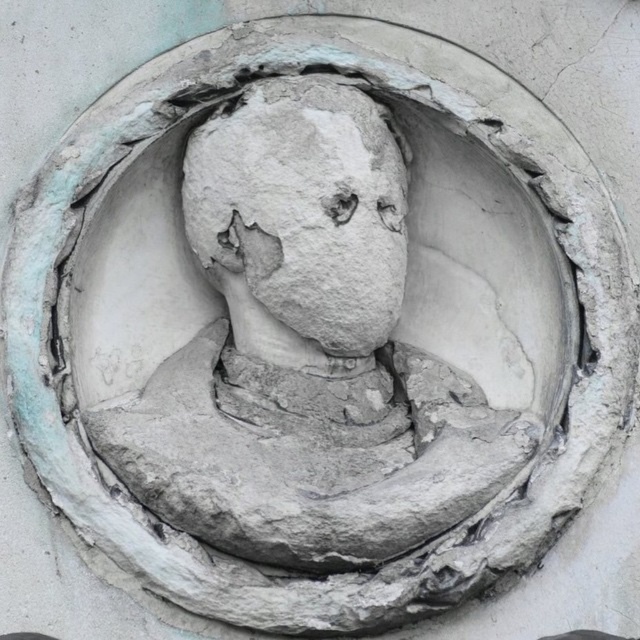
Question: Is white stone bust at center below gray stone face at center?

Choices:
 (A) no
 (B) yes

Answer: (B)

Question: In this image, where is white stone bust at center located relative to gray stone face at center?

Choices:
 (A) below
 (B) above

Answer: (A)

Question: Is white stone bust at center to the right of gray stone face at center from the viewer's perspective?

Choices:
 (A) no
 (B) yes

Answer: (B)